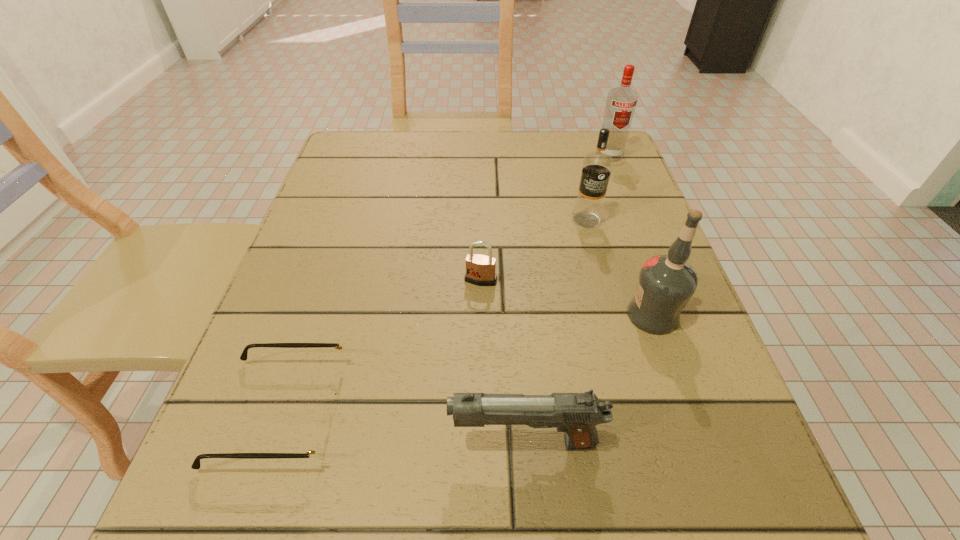
This screenshot has height=540, width=960. I want to click on vacant point that satisfies the following two spatial constraints: 1. on the front label of the farthest vodka; 2. on the front label of the nearest vodka, so click(671, 315).

This screenshot has height=540, width=960. I want to click on free point that satisfies the following two spatial constraints: 1. on the front label of the farthest object; 2. on the front label of the nearest vodka, so click(671, 315).